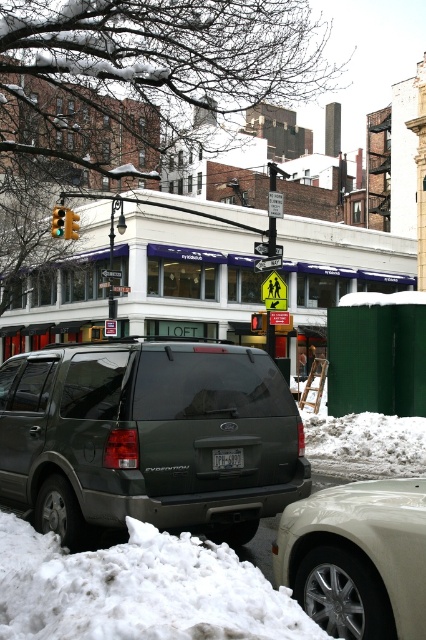
You are a GUI agent. You are given a task and a screenshot of the screen. Output one action in this format:
    pyautogui.click(x=<x>, y=<y>)
    Task: Click on the white fluffy snow at lower left
    The image size is (426, 640).
    Given the screenshot: What is the action you would take?
    point(138,589)

Is point (138, 608) closer to viewer compared to point (62, 214)?

That is True.

Image resolution: width=426 pixels, height=640 pixels. I want to click on white fluffy snow at lower left, so click(x=138, y=589).

From the picture: Does white metallic sedan at lower right have a greater height compared to yellow plastic traffic light at upper center?

No, white metallic sedan at lower right is not taller than yellow plastic traffic light at upper center.

Can you confirm if white metallic sedan at lower right is positioned below yellow plastic traffic light at upper center?

Correct, white metallic sedan at lower right is located below yellow plastic traffic light at upper center.

Does point (354, 493) lie in front of point (78, 228)?

Yes, point (354, 493) is in front of point (78, 228).

Locate an element on the screen. This screenshot has width=426, height=640. white metallic sedan at lower right is located at coordinates (357, 557).

Is white metallic sedan at lower right bigger than black plastic license plate at rear?

Yes, white metallic sedan at lower right is bigger than black plastic license plate at rear.

Does white metallic sedan at lower right have a smaller size compared to black plastic license plate at rear?

Incorrect, white metallic sedan at lower right is not smaller in size than black plastic license plate at rear.

The height and width of the screenshot is (640, 426). What do you see at coordinates (357, 557) in the screenshot?
I see `white metallic sedan at lower right` at bounding box center [357, 557].

Identify the location of white metallic sedan at lower right. This screenshot has width=426, height=640. (357, 557).